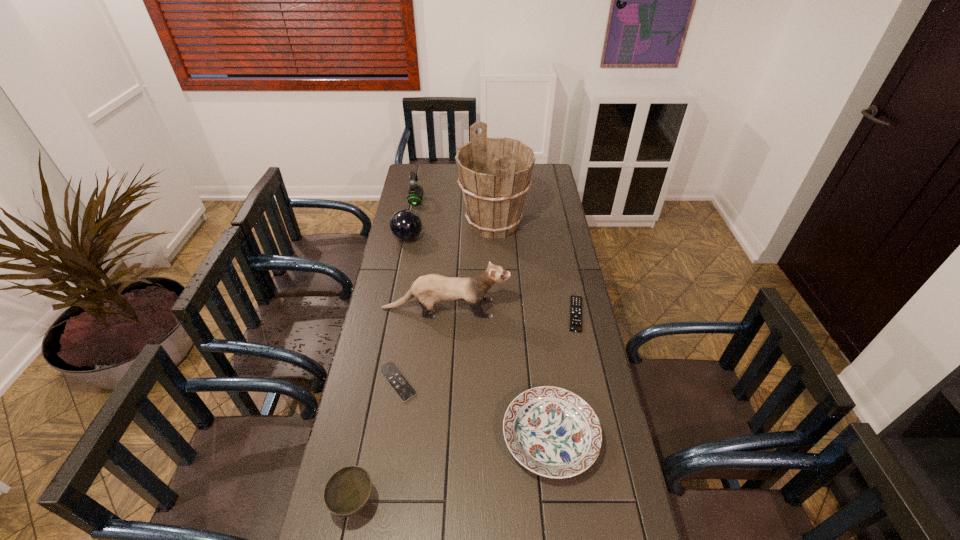
Locate an element on the screen. bucket is located at coordinates (494, 174).

Identify the location of ferret. (430, 289).

The image size is (960, 540). I want to click on headset, so click(x=415, y=191).

Locate an element on the screen. Image resolution: width=960 pixels, height=540 pixels. bowling ball is located at coordinates (405, 224).

Find the location of a particular element. This screenshot has width=960, height=540. the fifth tallest object is located at coordinates coord(348,490).

At what (x,y) coordinates should I click in order to perform the action: click on plate. Please return your answer as a coordinate pair (x, y). Image resolution: width=960 pixels, height=540 pixels. Looking at the image, I should click on (552, 432).

Identify the location of the seventh tallest object. (576, 301).

Find the location of a particular element. Image resolution: width=960 pixels, height=540 pixels. the right remote control is located at coordinates (576, 301).

Identify the location of the shorter remote control. Image resolution: width=960 pixels, height=540 pixels. (404, 390).

You are a GUI agent. You are given a task and a screenshot of the screen. Output one action in this format:
    pyautogui.click(x=<x>, y=<y>)
    Task: Click on the shortest object
    
    Given the screenshot: What is the action you would take?
    pyautogui.click(x=404, y=390)